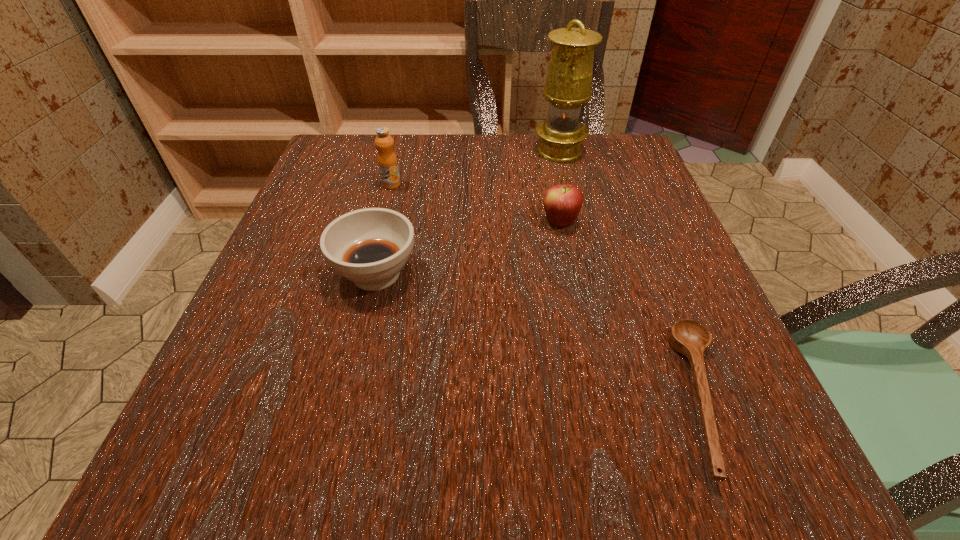
Where is `free location that satisfies the following two spatial constraints: 1. on the front side of the oil lamp; 2. on the left side of the nearest object`? The width and height of the screenshot is (960, 540). free location that satisfies the following two spatial constraints: 1. on the front side of the oil lamp; 2. on the left side of the nearest object is located at coordinates (621, 397).

At what (x,y) coordinates should I click in order to perform the action: click on vacant position in the image that satisfies the following two spatial constraints: 1. on the front label of the second shortest object; 2. on the right side of the fourth nearest object. Please return your answer as a coordinate pair (x, y). This screenshot has height=540, width=960. Looking at the image, I should click on (369, 274).

Where is `free point that satisfies the following two spatial constraints: 1. on the front label of the fourth nearest object; 2. on the right side of the soup bowl`? This screenshot has width=960, height=540. free point that satisfies the following two spatial constraints: 1. on the front label of the fourth nearest object; 2. on the right side of the soup bowl is located at coordinates [369, 274].

The width and height of the screenshot is (960, 540). I want to click on vacant position in the image that satisfies the following two spatial constraints: 1. on the front label of the third nearest object; 2. on the right side of the orange juice, so coord(382,222).